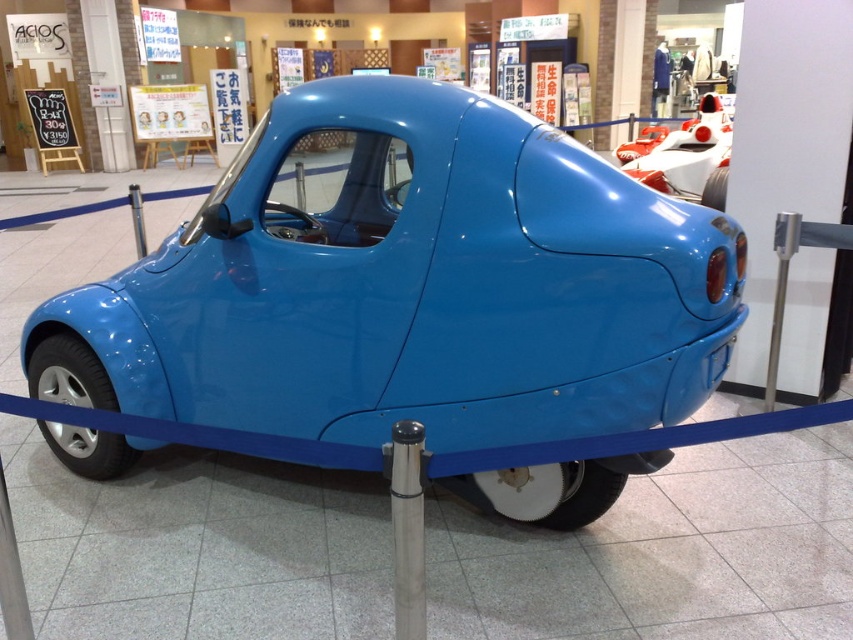
You are standing in an indoor exhibition space and want to take a photo of the glossy blue car at center. If you are positioned at point A, which is at coordinates 0.3, 0.3, would you be able to see the entire car in your view without moving?

The glossy blue car at center is located at point (408, 284). Since your position is at (254, 192), you might not be able to see the entire car in your view without moving, as the car is positioned further away from your current location.

You are an interior designer planning to place a new exhibit in the exhibition space. You have the glossy blue car at center and the white glossy race car at upper right. Which car requires more horizontal space to display properly?

The glossy blue car at center requires more horizontal space to display properly because its width is larger than the white glossy race car at upper right.

You are standing in the exhibition hall and want to take a photo of the glossy blue car at center. The exhibition hall has a rule that you must stand exactly at point A to take the best shot. If point A is at coordinates (x=408, y=284), are you currently positioned correctly to take the photo?

The glossy blue car at center is located at point (x=408, y=284), so yes, you are positioned correctly to take the photo.